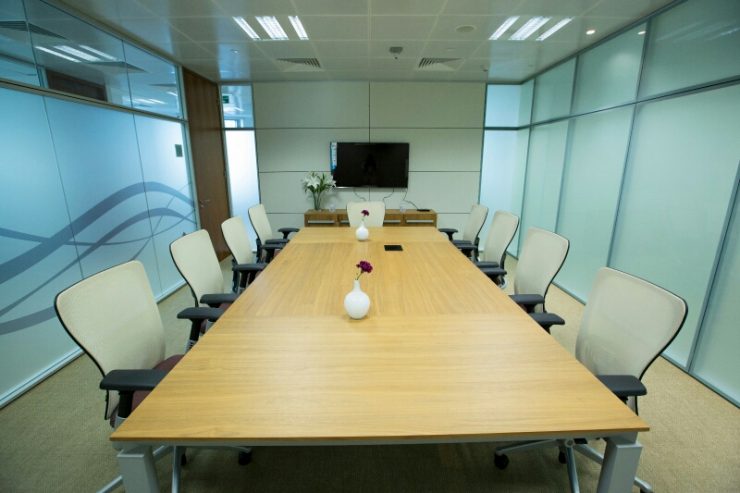
You are a GUI agent. You are given a task and a screenshot of the screen. Output one action in this format:
    pyautogui.click(x=<x>, y=<y>)
    Task: Click on the table legs
    The width and height of the screenshot is (740, 493).
    Given the screenshot: What is the action you would take?
    pyautogui.click(x=621, y=466), pyautogui.click(x=140, y=476)